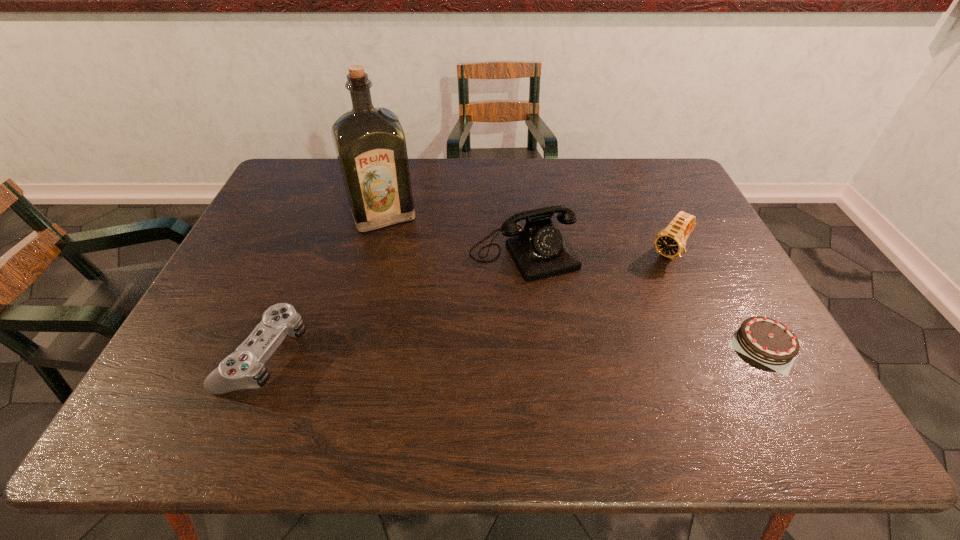
Find the location of `the second shortest object`. the second shortest object is located at coordinates (244, 368).

Identify the location of the shortest object. This screenshot has height=540, width=960. (767, 341).

Where is `the tallest object`? the tallest object is located at coordinates (370, 144).

This screenshot has width=960, height=540. In order to click on watch in this screenshot , I will do pyautogui.click(x=670, y=242).

Find the location of a particular element. the third object from left to right is located at coordinates (540, 250).

Where is `vacant space located on the back of the second shortest object`? vacant space located on the back of the second shortest object is located at coordinates (310, 245).

Locate an element on the screen. This screenshot has height=540, width=960. vacant space located 0.270m on the back of the chocolate cake is located at coordinates (708, 242).

Find the location of `vacant space located on the label of the liquor`. vacant space located on the label of the liquor is located at coordinates (423, 304).

The width and height of the screenshot is (960, 540). I want to click on vacant area situated 0.260m on the label of the liquor, so click(419, 293).

Locate an element on the screen. This screenshot has width=960, height=540. vacant space positioned on the label of the liquor is located at coordinates (408, 271).